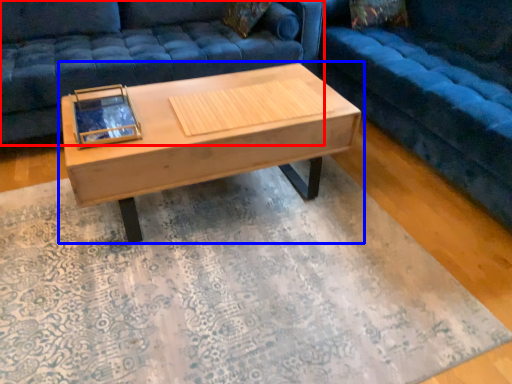
Question: Which of the following is the closest to the observer, studio couch (highlighted by a red box) or coffee table (highlighted by a blue box)?

Choices:
 (A) studio couch
 (B) coffee table

Answer: (B)